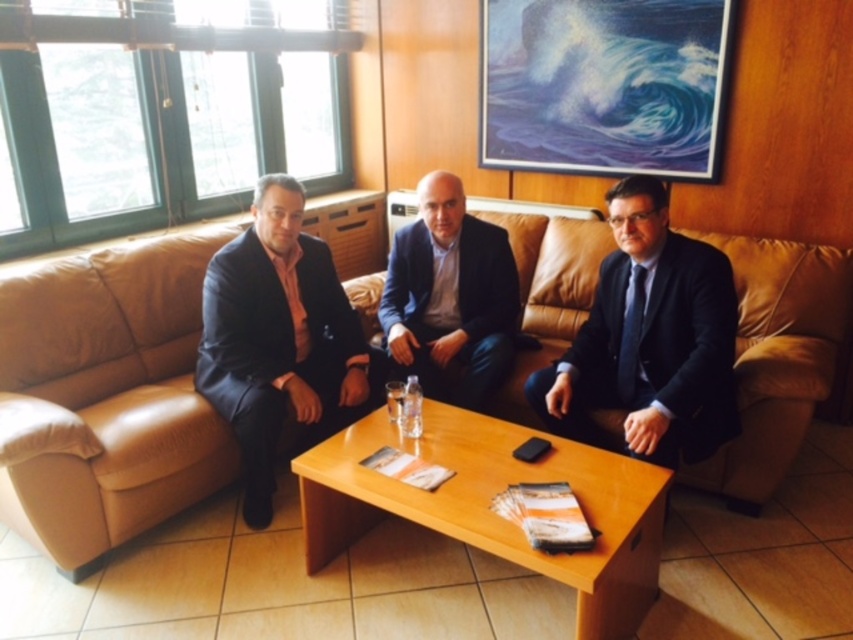
Question: Does matte black suit at left appear on the left side of dark blue suit at center?

Choices:
 (A) no
 (B) yes

Answer: (B)

Question: Which is farther from the black leather suit at center?

Choices:
 (A) matte black suit at left
 (B) wooden at center

Answer: (A)

Question: Among these objects, which one is nearest to the camera?

Choices:
 (A) black leather suit at center
 (B) leather couch at center
 (C) matte black suit at left

Answer: (B)

Question: Does matte black suit at left appear on the right side of dark blue suit at center?

Choices:
 (A) yes
 (B) no

Answer: (B)

Question: Which of these objects is positioned farthest from the leather couch at center?

Choices:
 (A) wooden at center
 (B) dark blue suit at center

Answer: (A)

Question: Does black leather suit at center have a greater width compared to dark blue suit at center?

Choices:
 (A) yes
 (B) no

Answer: (A)